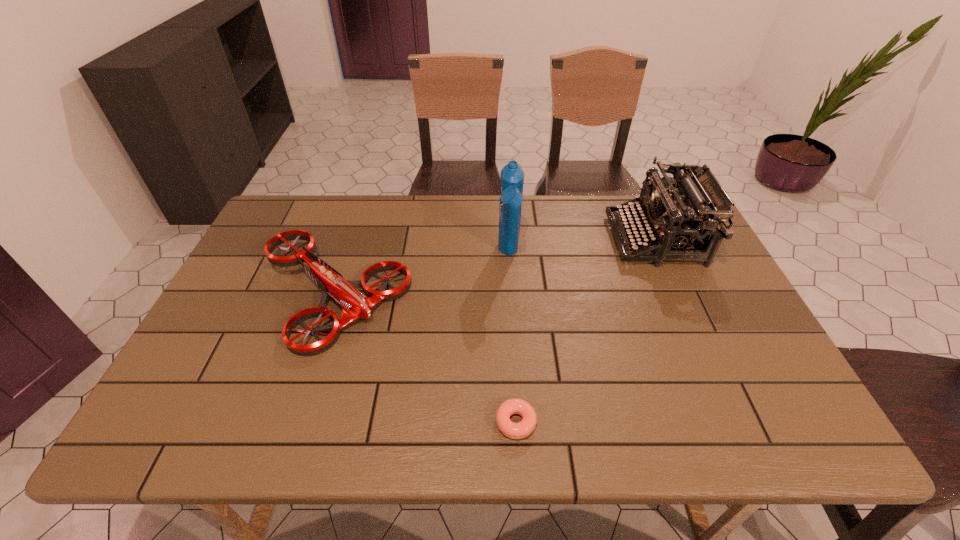
Find the location of a particular element. The width and height of the screenshot is (960, 540). free area in between the tallest object and the doughnut is located at coordinates (513, 338).

Identify the location of free space between the shampoo and the doughnut. (513, 338).

Image resolution: width=960 pixels, height=540 pixels. Find the location of `vacant area between the shampoo and the nearest object`. vacant area between the shampoo and the nearest object is located at coordinates (513, 338).

Identify which object is the second closest to the rightmost object. Please provide its 2D coordinates. Your answer should be formatted as a tuple, i.e. [(x, y)], where the tuple contains the x and y coordinates of a point satisfying the conditions above.

[(525, 427)]

Identify the location of object that is the third closest one to the tallest object. (525, 427).

Identify the location of free space that satisfies the following two spatial constraints: 1. on the back side of the tallest object; 2. on the right side of the third tallest object. The image size is (960, 540). (348, 254).